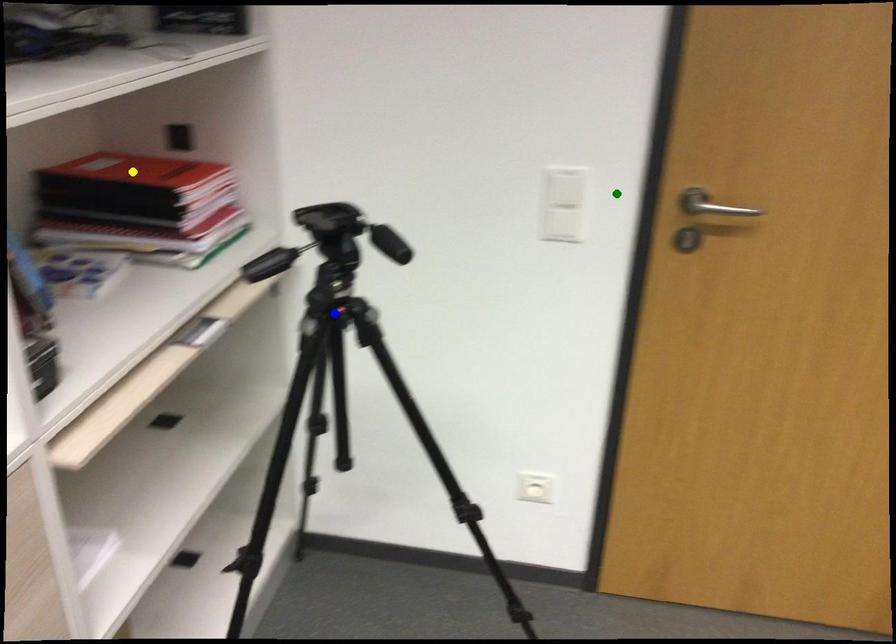
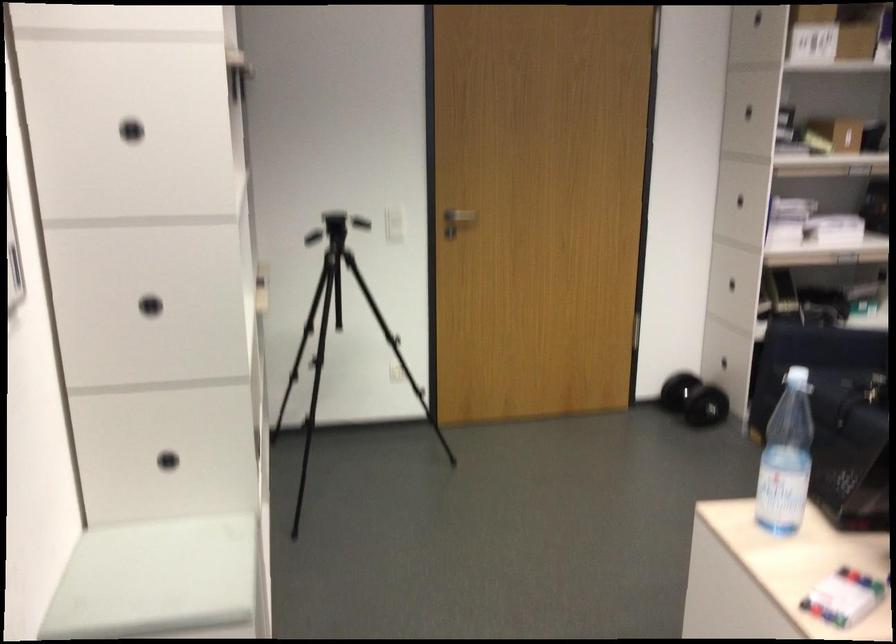
I am providing you with two images of the same scene from different viewpoints. Three points are marked in image1. Which point corresponds to a part or object that is occluded in image2?In image1, three points are marked. Which of them correspond to a part or object that is occluded in image2?Among the three points shown in image1, which one corresponds to a part or object that is no longer visible due to occlusion in image2?

Invisible in image2: yellow point, blue point.